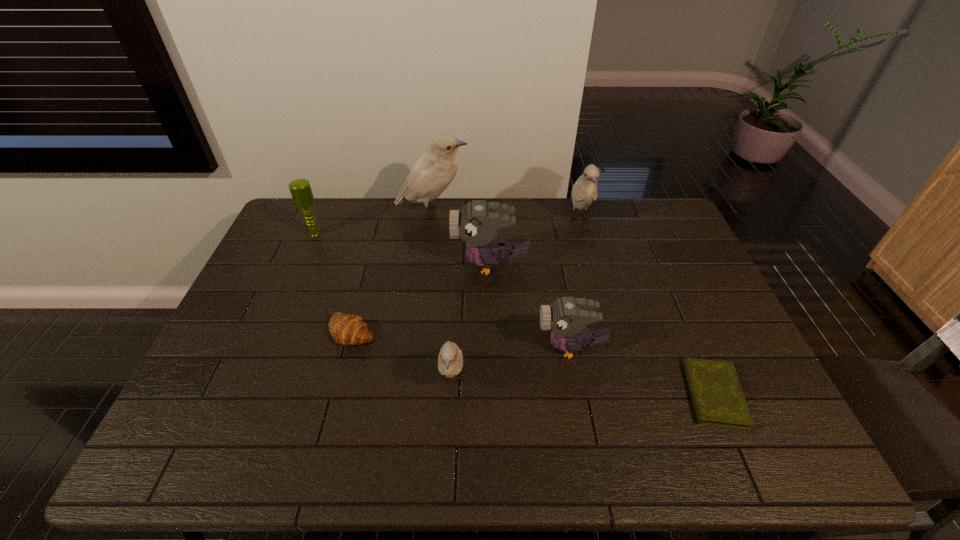
I want to click on free space that satisfies the following two spatial constraints: 1. at the beak of the second biggest white bird; 2. at the beak of the third farthest bird, so click(x=591, y=265).